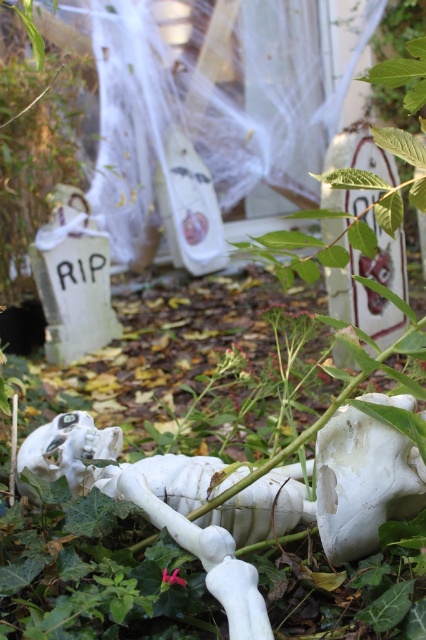
You are standing at the center of the scene and want to place a small pumpkin decoration. The pumpkin has a diameter of 15 cm. The coordinates of the white matte skull at lower center are at point 0.755, 0.852. Can you place the pumpkin at the same coordinates without overlapping the skull?

The white matte skull at lower center is located at point (362, 483). Since the pumpkin has a diameter of 15 cm, placing it at the exact coordinates would overlap with the skull. Choose a different spot.

You are a visitor at a Halloween decoration store and want to place two white matte skulls in a garden. The store has a shelf with the two skulls. The first is labeled as the white matte skull at lower center, and the second is labeled as the white matte skull at center. You want to arrange them so that one is closer to visitors and the other is further back. Which skull should you place closer to the visitors?

→ The white matte skull at lower center should be placed closer to the visitors because it is described as being closer to the viewer than the white matte skull at center.